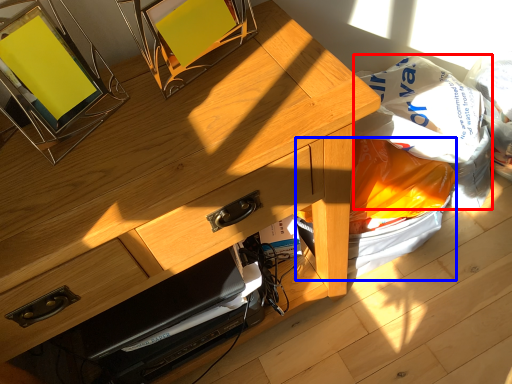
Question: Which point is closer to the camera, grocery bag (highlighted by a red box) or garbage (highlighted by a blue box)?

Choices:
 (A) grocery bag
 (B) garbage

Answer: (A)